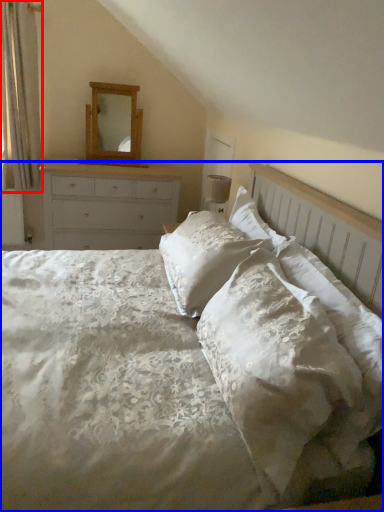
Question: Among these objects, which one is nearest to the camera, curtain (highlighted by a red box) or bed (highlighted by a blue box)?

Choices:
 (A) curtain
 (B) bed

Answer: (B)